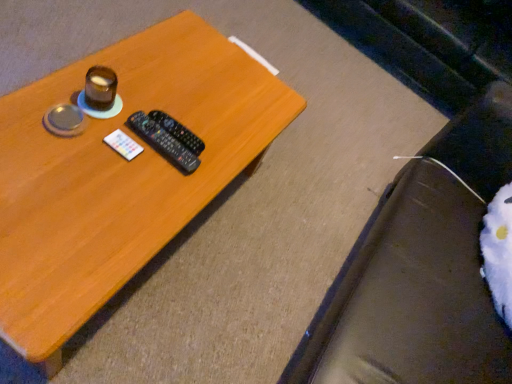
Question: Is black plastic remote control at center, the 1th remote control viewed from the back, surrounded by white fuzzy bean bag chair at lower right?

Choices:
 (A) no
 (B) yes

Answer: (A)

Question: From a real-world perspective, is white fuzzy bean bag chair at lower right on top of black plastic remote control at center, placed as the second remote control when sorted from front to back?

Choices:
 (A) no
 (B) yes

Answer: (B)

Question: Can you confirm if white fuzzy bean bag chair at lower right is positioned to the right of black plastic remote control at center, placed as the second remote control when sorted from front to back?

Choices:
 (A) yes
 (B) no

Answer: (A)

Question: Is the depth of white fuzzy bean bag chair at lower right greater than that of black plastic remote control at center, the 1th remote control viewed from the back?

Choices:
 (A) yes
 (B) no

Answer: (B)

Question: Is white fuzzy bean bag chair at lower right facing away from black plastic remote control at center, placed as the second remote control when sorted from front to back?

Choices:
 (A) yes
 (B) no

Answer: (B)

Question: Does white fuzzy bean bag chair at lower right have a lesser width compared to black plastic remote control at center, placed as the second remote control when sorted from front to back?

Choices:
 (A) no
 (B) yes

Answer: (A)

Question: Can you confirm if shiny brown cup at upper left is taller than black plastic remote at center, placed as the second remote control when sorted from back to front?

Choices:
 (A) yes
 (B) no

Answer: (A)

Question: Considering the relative sizes of shiny brown cup at upper left and black plastic remote at center, which is the 1th remote control in front-to-back order, in the image provided, is shiny brown cup at upper left smaller than black plastic remote at center, which is the 1th remote control in front-to-back order,?

Choices:
 (A) no
 (B) yes

Answer: (A)

Question: Does shiny brown cup at upper left have a lesser width compared to black plastic remote at center, which is the 1th remote control in front-to-back order?

Choices:
 (A) no
 (B) yes

Answer: (B)

Question: Is shiny brown cup at upper left to the right of black plastic remote at center, which is the 1th remote control in front-to-back order, from the viewer's perspective?

Choices:
 (A) yes
 (B) no

Answer: (B)

Question: From a real-world perspective, is shiny brown cup at upper left beneath black plastic remote at center, placed as the second remote control when sorted from back to front?

Choices:
 (A) yes
 (B) no

Answer: (B)

Question: From the image's perspective, does shiny brown cup at upper left appear higher than black plastic remote at center, which is the 1th remote control in front-to-back order?

Choices:
 (A) yes
 (B) no

Answer: (A)

Question: Is black plastic remote at center, placed as the second remote control when sorted from back to front, at the right side of black plastic remote control at center, placed as the second remote control when sorted from front to back?

Choices:
 (A) yes
 (B) no

Answer: (B)